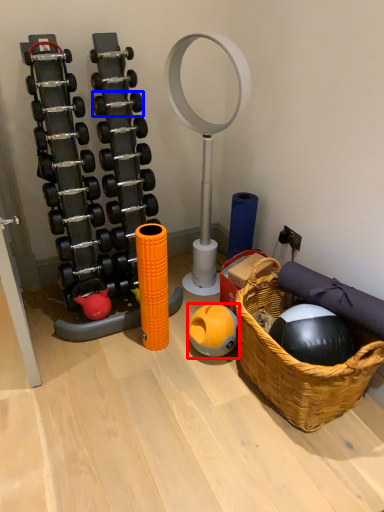
Question: Which point is further to the camera, ball (highlighted by a red box) or dumbbell (highlighted by a blue box)?

Choices:
 (A) ball
 (B) dumbbell

Answer: (B)